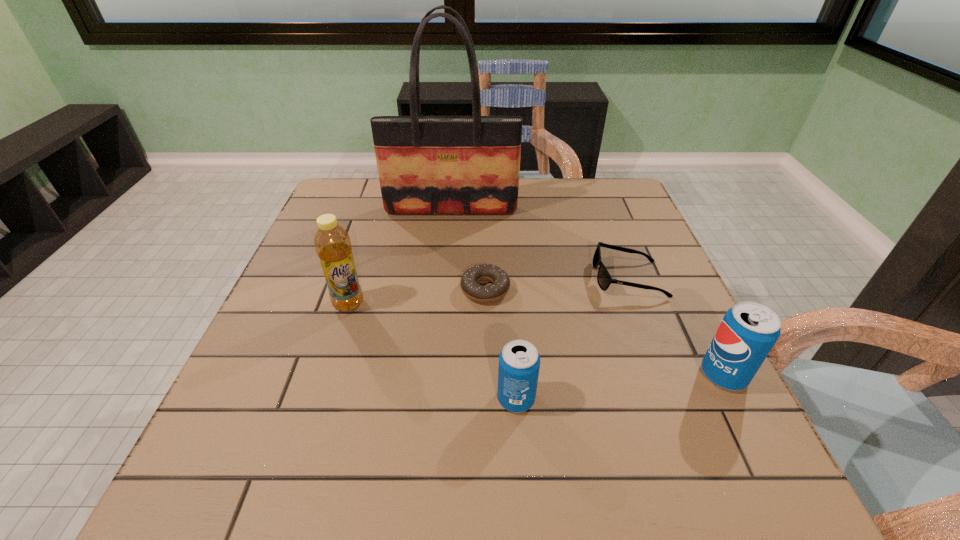
The height and width of the screenshot is (540, 960). In order to click on vacant region located on the back of the fourth shortest object in this screenshot , I will do `click(659, 246)`.

In order to click on vacant space situated 0.380m on the front-facing side of the tallest object in this screenshot , I will do `click(441, 319)`.

The height and width of the screenshot is (540, 960). Identify the location of vacant region located on the right of the doughnut. (623, 289).

Find the location of `vacant area located 0.360m on the back of the bottle`. vacant area located 0.360m on the back of the bottle is located at coordinates (379, 208).

This screenshot has height=540, width=960. I want to click on free point located on the front-facing side of the second shortest object, so click(x=425, y=278).

The height and width of the screenshot is (540, 960). In order to click on blank space located 0.180m on the front-facing side of the second shortest object in this screenshot , I will do `click(518, 278)`.

Where is `free region located 0.330m on the front-facing side of the second shortest object`? free region located 0.330m on the front-facing side of the second shortest object is located at coordinates (455, 278).

You are a GUI agent. You are given a task and a screenshot of the screen. Output one action in this format:
    pyautogui.click(x=<x>, y=<y>)
    Task: Click on the object situated at the far edge
    The width and height of the screenshot is (960, 540).
    Given the screenshot: What is the action you would take?
    pyautogui.click(x=426, y=164)

Find the location of a particular element. The image size is (960, 540). object present at the near edge is located at coordinates (519, 361).

Find the location of `object located in the left edge section of the desktop`. object located in the left edge section of the desktop is located at coordinates (332, 243).